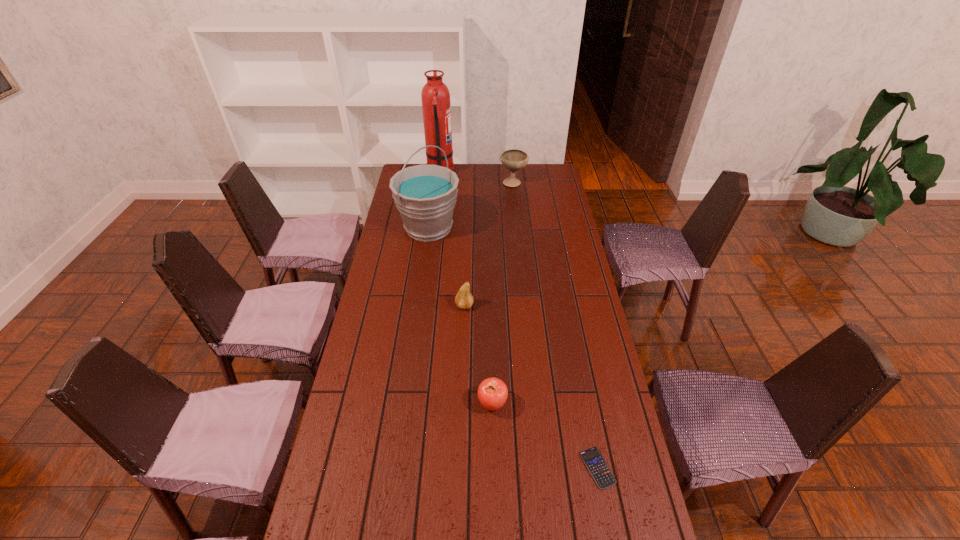
I want to click on object present at the right edge, so click(594, 461).

The width and height of the screenshot is (960, 540). Find the location of `object located at the far left corner`. object located at the far left corner is located at coordinates (436, 107).

Locate an element on the screen. The width and height of the screenshot is (960, 540). vacant space at the far edge is located at coordinates (499, 187).

This screenshot has height=540, width=960. Identify the location of vacant space at the left edge of the desktop. (415, 239).

Where is `vacant space at the far right corner of the desktop`? This screenshot has height=540, width=960. vacant space at the far right corner of the desktop is located at coordinates click(546, 177).

Image resolution: width=960 pixels, height=540 pixels. I want to click on free space between the third farthest object and the third tallest object, so click(x=470, y=205).

Find the location of a particular element. free space between the fourth shortest object and the fifth farthest object is located at coordinates (503, 293).

I want to click on vacant area that lies between the rightmost object and the pear, so click(x=531, y=387).

I want to click on vacant area between the fire extinguisher and the fourth farthest object, so click(452, 240).

At what (x,y) coordinates should I click in order to perform the action: click on unoccupied position between the calculator and the apple. Please return your answer as a coordinate pair (x, y). The height and width of the screenshot is (540, 960). Looking at the image, I should click on (545, 436).